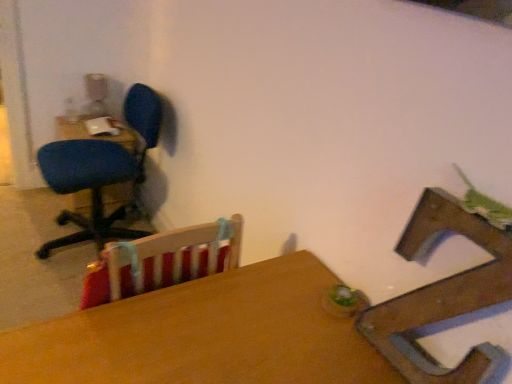
Question: Should I look upward or downward to see blue fabric office chair at left, arranged as the first chair when viewed from the left?

Choices:
 (A) down
 (B) up

Answer: (B)

Question: Is wooden chair at center, the second chair viewed from the back, further to camera compared to matte blue chair at left, marked as the second table in a bottom-to-top arrangement?

Choices:
 (A) yes
 (B) no

Answer: (B)

Question: From the image's perspective, does wooden chair at center, which is the second chair in left-to-right order, appear higher than matte blue chair at left, the 1th table when ordered from left to right?

Choices:
 (A) yes
 (B) no

Answer: (B)

Question: Is wooden chair at center, which appears as the 1th chair when viewed from the front, touching matte blue chair at left, marked as the second table in a right-to-left arrangement?

Choices:
 (A) yes
 (B) no

Answer: (B)

Question: Considering the relative sizes of wooden chair at center, which is the second chair in left-to-right order, and matte blue chair at left, the 1th table viewed from the back, in the image provided, is wooden chair at center, which is the second chair in left-to-right order, thinner than matte blue chair at left, the 1th table viewed from the back,?

Choices:
 (A) no
 (B) yes

Answer: (B)

Question: Is matte blue chair at left, positioned as the second table in front-to-back order, inside wooden chair at center, which appears as the 1th chair when viewed from the front?

Choices:
 (A) yes
 (B) no

Answer: (B)

Question: Is wooden chair at center, which is the second chair in left-to-right order, aimed at matte blue chair at left, marked as the second table in a bottom-to-top arrangement?

Choices:
 (A) no
 (B) yes

Answer: (A)

Question: Is matte blue chair at left, marked as the second table in a right-to-left arrangement, placed right next to wooden chair at center, which appears as the 1th chair when viewed from the front?

Choices:
 (A) no
 (B) yes

Answer: (A)

Question: Could you tell me if matte blue chair at left, the 1th table viewed from the back, is facing wooden chair at center, positioned as the 1th chair in right-to-left order?

Choices:
 (A) yes
 (B) no

Answer: (A)

Question: Does matte blue chair at left, the 1th table when ordered from top to bottom, have a lesser width compared to wooden chair at center, the second chair viewed from the back?

Choices:
 (A) no
 (B) yes

Answer: (A)

Question: Can you confirm if matte blue chair at left, marked as the second table in a bottom-to-top arrangement, is positioned to the left of wooden chair at center, which is the second chair in left-to-right order?

Choices:
 (A) no
 (B) yes

Answer: (B)

Question: Can you confirm if matte blue chair at left, marked as the second table in a right-to-left arrangement, is smaller than wooden chair at center, positioned as the 1th chair in right-to-left order?

Choices:
 (A) yes
 (B) no

Answer: (B)

Question: Is matte blue chair at left, positioned as the second table in front-to-back order, turned away from wooden chair at center, the second chair viewed from the back?

Choices:
 (A) no
 (B) yes

Answer: (A)

Question: From the image's perspective, would you say blue fabric office chair at left, which is the 2th chair from front to back, is shown under wooden chair at center, the second chair viewed from the back?

Choices:
 (A) no
 (B) yes

Answer: (A)